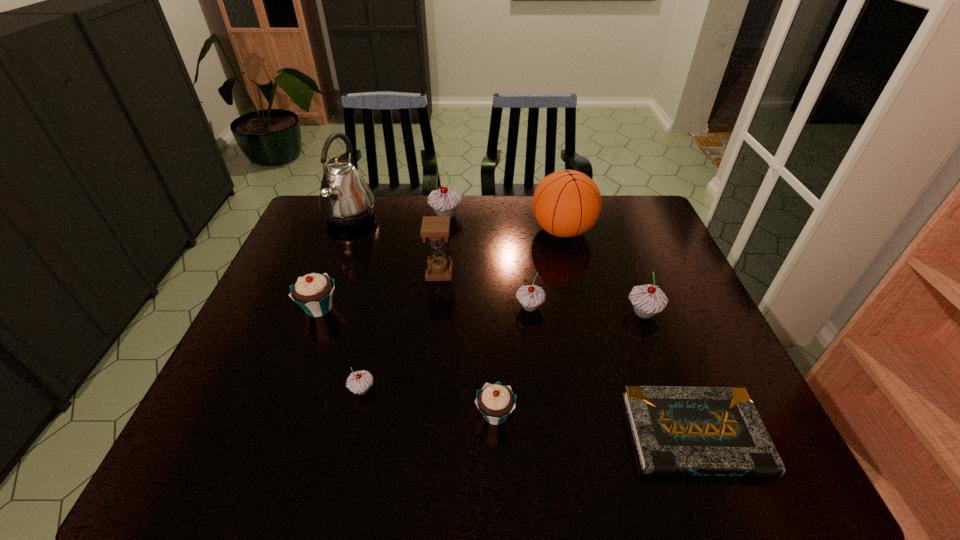
Identify the location of the tallest object. This screenshot has height=540, width=960. (345, 199).

Identify the location of basketball. (567, 203).

Identify the location of the biggest gray cupcake. The width and height of the screenshot is (960, 540). pyautogui.click(x=445, y=201).

Find the location of `the farthest cupcake`. the farthest cupcake is located at coordinates (445, 201).

You are a GUI agent. You are given a task and a screenshot of the screen. Output one action in this format:
    pyautogui.click(x=<x>, y=<y>)
    Task: Click on the hourglass
    Image resolution: width=960 pixels, height=540 pixels.
    Given the screenshot: What is the action you would take?
    pyautogui.click(x=436, y=228)

Where is `the fifth tallest object`? the fifth tallest object is located at coordinates (x=647, y=300).

Find the location of a particular element. the rightmost gray cupcake is located at coordinates (647, 300).

Locate an element on the screen. The width and height of the screenshot is (960, 540). the second cupcake from right to left is located at coordinates (530, 296).

The width and height of the screenshot is (960, 540). In order to click on the second gray cupcake from right to left in this screenshot , I will do `click(530, 296)`.

Find the location of a particular element. the left teal cupcake is located at coordinates [x=313, y=292].